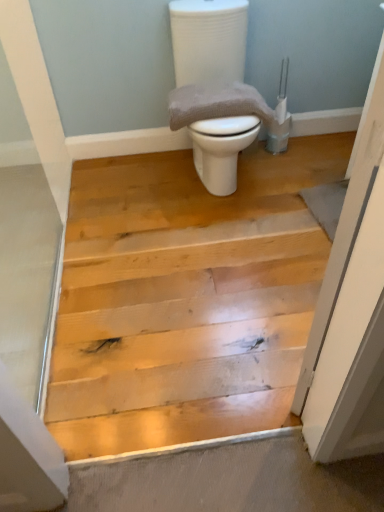
Question: From a real-world perspective, is gray textured towel at center located beneath white glossy toilet at center?

Choices:
 (A) no
 (B) yes

Answer: (A)

Question: Can you confirm if gray textured towel at center is thinner than white glossy toilet at center?

Choices:
 (A) no
 (B) yes

Answer: (B)

Question: Is gray textured towel at center located outside white glossy toilet at center?

Choices:
 (A) yes
 (B) no

Answer: (B)

Question: Is white glossy toilet at center surrounded by gray textured towel at center?

Choices:
 (A) no
 (B) yes

Answer: (A)

Question: Considering the relative positions of gray textured towel at center and white glossy toilet at center in the image provided, is gray textured towel at center to the right of white glossy toilet at center from the viewer's perspective?

Choices:
 (A) yes
 (B) no

Answer: (B)

Question: Considering the relative sizes of gray textured towel at center and white glossy toilet at center in the image provided, is gray textured towel at center bigger than white glossy toilet at center?

Choices:
 (A) yes
 (B) no

Answer: (B)

Question: From a real-world perspective, is white glossy toilet at center positioned under gray textured towel at center based on gravity?

Choices:
 (A) yes
 (B) no

Answer: (A)

Question: Would you say white glossy toilet at center is outside gray textured towel at center?

Choices:
 (A) yes
 (B) no

Answer: (A)

Question: From the image's perspective, would you say white glossy toilet at center is positioned over gray textured towel at center?

Choices:
 (A) yes
 (B) no

Answer: (A)

Question: Can you confirm if white glossy toilet at center is taller than gray textured towel at center?

Choices:
 (A) no
 (B) yes

Answer: (B)

Question: Does white glossy toilet at center have a larger size compared to gray textured towel at center?

Choices:
 (A) no
 (B) yes

Answer: (B)

Question: Does white glossy toilet at center appear on the left side of gray textured towel at center?

Choices:
 (A) yes
 (B) no

Answer: (B)

Question: Is point [x=256, y=108] positioned closer to the camera than point [x=230, y=136]?

Choices:
 (A) farther
 (B) closer

Answer: (A)